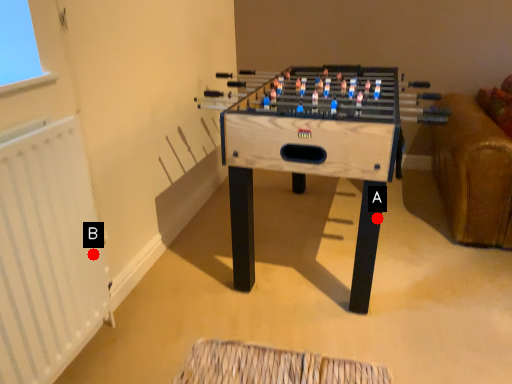
Question: Two points are circled on the image, labeled by A and B beside each circle. Which point appears farthest from the camera in this image?

Choices:
 (A) A is further
 (B) B is further

Answer: (A)